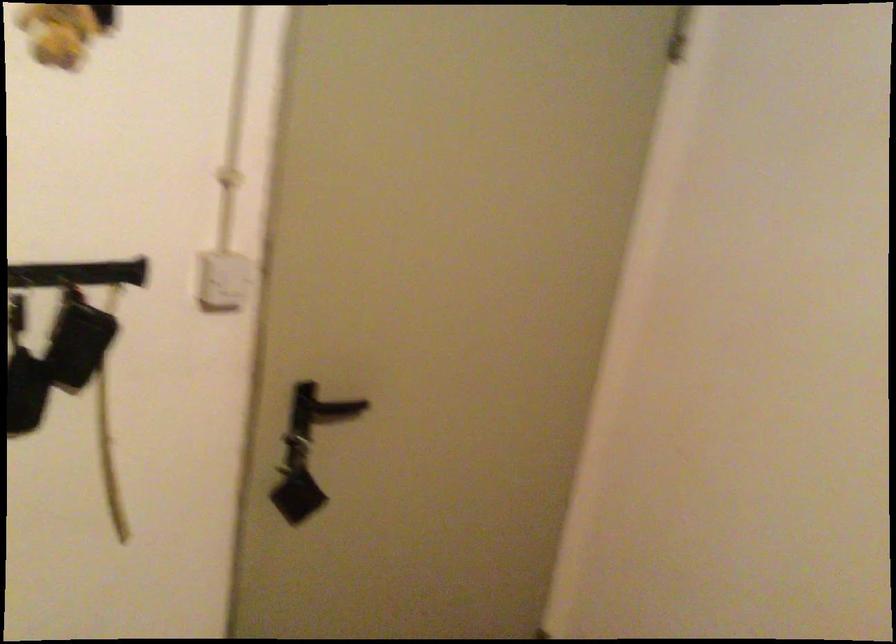
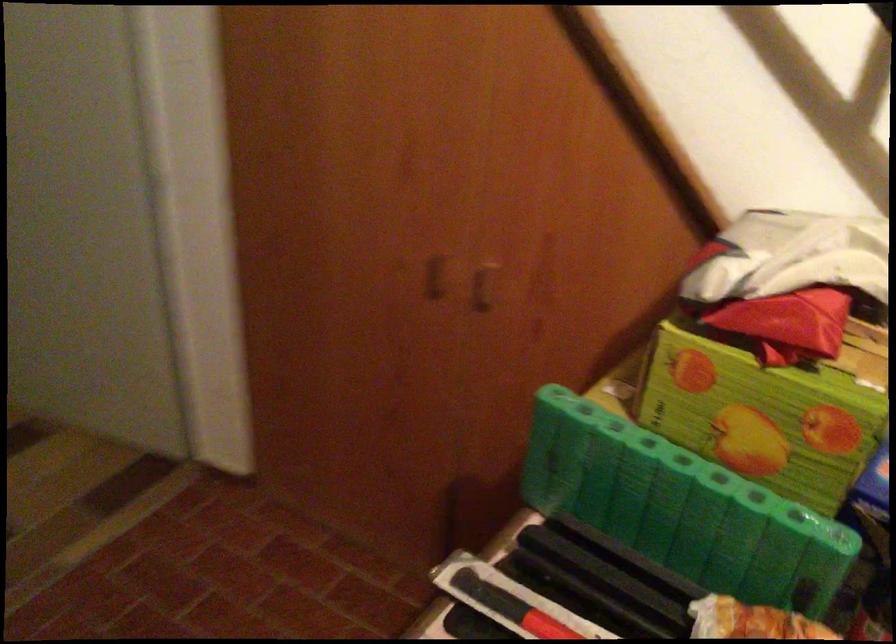
Based on the continuous images, in which direction is the camera rotating?

The rotation direction of the camera is right-down.